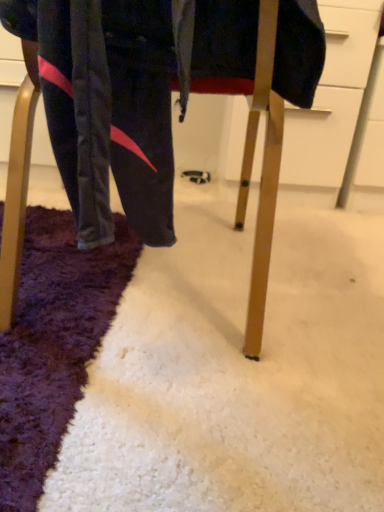
Question: Should I look upward or downward to see wooden chair at center?

Choices:
 (A) down
 (B) up

Answer: (B)